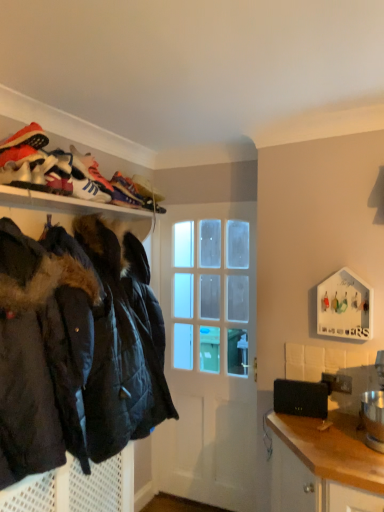
Question: Considering the positions of point (130, 423) and point (236, 284), is point (130, 423) closer or farther from the camera than point (236, 284)?

Choices:
 (A) farther
 (B) closer

Answer: (B)

Question: In the image, is black quilted jacket at left on the left side or the right side of white glossy door at center?

Choices:
 (A) left
 (B) right

Answer: (A)

Question: Estimate the real-world distances between objects in this image. Which object is farther from the white glossy door at center?

Choices:
 (A) black matte laptop at lower right
 (B) white leather sneaker at upper left
 (C) black quilted jacket at lower left
 (D) matte black jackets at upper left
 (E) black quilted jacket at left

Answer: (B)

Question: Which is farther from the white leather sneaker at upper left?

Choices:
 (A) matte black jackets at upper left
 (B) white glossy door at center
 (C) black matte laptop at lower right
 (D) black quilted jacket at left
 (E) black quilted jacket at lower left

Answer: (E)